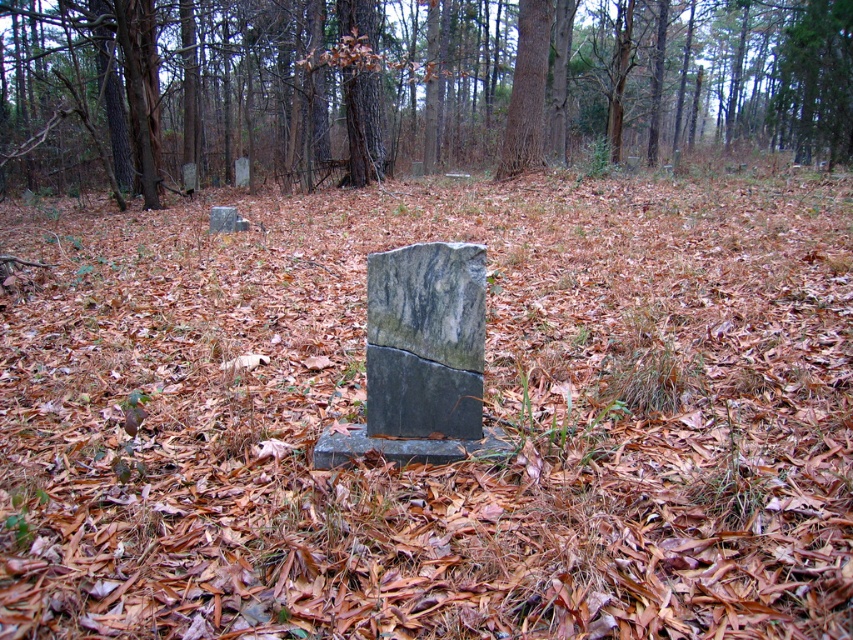
You are a hiker who has stumbled upon this abandoned cemetery. You notice the marble gravestone at center and the smooth brown bark at center. Which object is larger in size?

The smooth brown bark at center is larger than the marble gravestone at center.

You are a hiker who has stumbled upon this cemetery. You notice the marble gravestone at center and the smooth brown bark at center. Which object is located to the right when facing the scene?

The smooth brown bark at center is located to the right of the marble gravestone at center.

You are a park ranger trying to identify two objects in the image. You see a smooth gray stone at center and a smooth brown bark at center. Which object is wider?

The smooth gray stone at center is wider than the smooth brown bark at center.